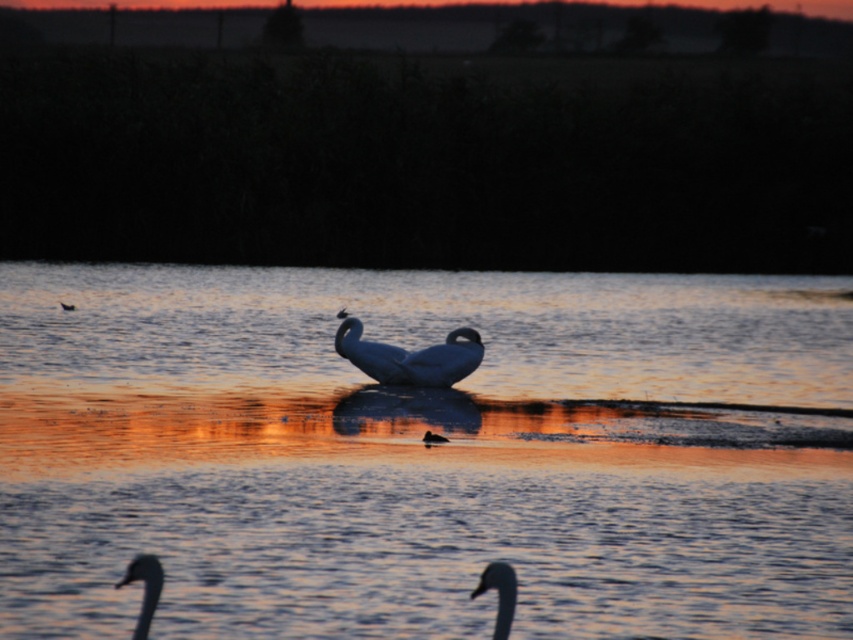
You are an ornithologist observing the scene. You need to determine if the glistening water at center can accommodate the white glossy swan at lower left for it to fully extend its wings without touching the edges. Can it?

The glistening water at center is wider than the white glossy swan at lower left, so yes, the swan can fully extend its wings without touching the edges.

In the scene shown: You are standing on a wooden pier that is 1.5 meters wide. You want to walk to the edge of the pier to get a closer look at the glistening water at center. Is there enough space for you to safely walk to the edge without falling into the water?

The glistening water at center and viewer are 6.33 meters apart. Since the wooden pier is 1.5 meters wide, you can safely walk to the edge as the distance between you and the water is greater than the pier width.

You are a photographer trying to capture the white glossy swan at lower center and the brown fuzzy duck at center in a single frame. Based on their positions, which of these birds will appear closer to the camera in your photo?

The white glossy swan at lower center is in front of the brown fuzzy duck at center, so it will appear closer to the camera in the photo.